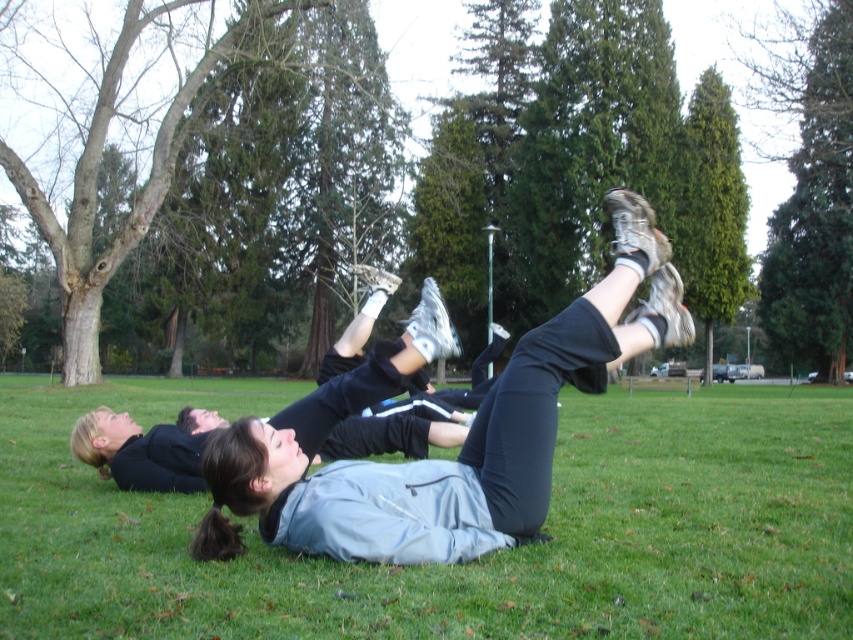
Is point (177, 548) positioned before point (543, 332)?

No, (177, 548) is further to viewer.

Between green grass at center and matte gray jacket at center, which one is positioned higher?

matte gray jacket at center is above.

The image size is (853, 640). What are the coordinates of `green grass at center` in the screenshot? It's located at (467, 563).